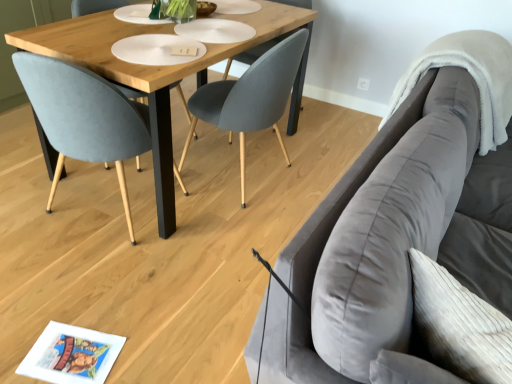
What is the approximate height of matte gray chair at center, which appears as the second chair when viewed from the left?

matte gray chair at center, which appears as the second chair when viewed from the left, is 84.76 centimeters in height.

Find the location of `white fluffy blanket at upper right`. white fluffy blanket at upper right is located at coordinates (471, 75).

What do you see at coordinates (151, 70) in the screenshot? This screenshot has width=512, height=384. I see `wooden table at center` at bounding box center [151, 70].

The image size is (512, 384). Identify the location of velvet blue chair at center, which appears as the 1th chair when viewed from the left. (84, 116).

Is white fluffy blanket at upper right bigger or smaller than velvet gray couch at right?

Considering their sizes, white fluffy blanket at upper right takes up less space than velvet gray couch at right.

Considering the sizes of white fluffy blanket at upper right and velvet gray couch at right in the image, is white fluffy blanket at upper right taller or shorter than velvet gray couch at right?

Considering their sizes, white fluffy blanket at upper right has less height than velvet gray couch at right.

Is white fluffy blanket at upper right far from velvet gray couch at right?

No, there isn't a large distance between white fluffy blanket at upper right and velvet gray couch at right.

How many degrees apart are the facing directions of wooden table at center and velvet gray couch at right?

wooden table at center and velvet gray couch at right are facing 1.5 degrees away from each other.

Are wooden table at center and velvet gray couch at right far apart?

Yes, wooden table at center and velvet gray couch at right are located far from each other.

Considering the relative positions of wooden table at center and velvet gray couch at right in the image provided, is wooden table at center behind velvet gray couch at right?

Yes, it is behind velvet gray couch at right.

Considering the positions of objects wooden table at center and velvet gray couch at right in the image provided, who is more to the left, wooden table at center or velvet gray couch at right?

wooden table at center is more to the left.

This screenshot has height=384, width=512. Identify the location of chair that is in front of the wooden table at center. (84, 116).

From the image's perspective, is wooden table at center located above or below velvet blue chair at center, which appears as the 1th chair when viewed from the left?

wooden table at center is situated higher than velvet blue chair at center, which appears as the 1th chair when viewed from the left, in the image.

Between wooden table at center and velvet blue chair at center, which is counted as the 2th chair, starting from the right, which one has less height?

Standing shorter between the two is wooden table at center.

Can you tell me how much wooden table at center and velvet blue chair at center, which appears as the 1th chair when viewed from the left, differ in facing direction?

The angle between the facing direction of wooden table at center and the facing direction of velvet blue chair at center, which appears as the 1th chair when viewed from the left, is 99.6 degrees.

Considering the relative sizes of white fluffy blanket at upper right and wooden table at center in the image provided, is white fluffy blanket at upper right shorter than wooden table at center?

Yes, white fluffy blanket at upper right is shorter than wooden table at center.

Is white fluffy blanket at upper right positioned far away from wooden table at center?

No, white fluffy blanket at upper right is not far from wooden table at center.

Which object is closer to the camera, white fluffy blanket at upper right or wooden table at center?

wooden table at center is more forward.

Based on their positions, is white fluffy blanket at upper right located to the left or right of wooden table at center?

white fluffy blanket at upper right is positioned on wooden table at center's right side.

Can you tell me how much wooden table at center and white fluffy blanket at upper right differ in facing direction?

1.5 degrees separate the facing orientations of wooden table at center and white fluffy blanket at upper right.

Choose the correct answer: Is wooden table at center inside white fluffy blanket at upper right or outside it?

wooden table at center is outside white fluffy blanket at upper right.

Considering the relative positions of wooden table at center and white fluffy blanket at upper right in the image provided, is wooden table at center to the left or to the right of white fluffy blanket at upper right?

wooden table at center is positioned on white fluffy blanket at upper right's left side.

Which of these two, matte gray chair at center, the 1th chair in the right-to-left sequence, or wooden table at center, is smaller?

With smaller size is matte gray chair at center, the 1th chair in the right-to-left sequence.

Is matte gray chair at center, the 1th chair in the right-to-left sequence, spatially inside wooden table at center, or outside of it?

matte gray chair at center, the 1th chair in the right-to-left sequence, lies within the bounds of wooden table at center.

From the image's perspective, is matte gray chair at center, the 1th chair in the right-to-left sequence, on top of wooden table at center?

Incorrect, from the image's perspective, matte gray chair at center, the 1th chair in the right-to-left sequence, is lower than wooden table at center.

Is matte gray chair at center, which appears as the second chair when viewed from the left, positioned in front of wooden table at center?

No, it is not.

Looking at this image, from the image's perspective, between velvet gray couch at right and white fluffy blanket at upper right, which one is located above?

From the image's view, white fluffy blanket at upper right is above.

From a real-world perspective, which is physically above, velvet gray couch at right or white fluffy blanket at upper right?

white fluffy blanket at upper right, from a real-world perspective.

Considering the positions of objects velvet gray couch at right and white fluffy blanket at upper right in the image provided, who is more to the right, velvet gray couch at right or white fluffy blanket at upper right?

From the viewer's perspective, white fluffy blanket at upper right appears more on the right side.

In the image, there is a velvet gray couch at right. Find the location of `blanket above it (from the image's perspective)`. blanket above it (from the image's perspective) is located at coordinates (471, 75).

Find the location of a particular element. studio couch to the right of wooden table at center is located at coordinates (400, 227).

Considering their positions, is velvet blue chair at center, which is counted as the 2th chair, starting from the right, positioned further to matte gray chair at center, the 1th chair in the right-to-left sequence, than white fluffy blanket at upper right?

white fluffy blanket at upper right is further to matte gray chair at center, the 1th chair in the right-to-left sequence.

Considering their positions, is white fluffy blanket at upper right positioned further to wooden table at center than velvet gray couch at right?

Based on the image, velvet gray couch at right appears to be further to wooden table at center.

Looking at the image, which one is located further to wooden table at center, velvet blue chair at center, which appears as the 1th chair when viewed from the left, or white fluffy blanket at upper right?

Among the two, white fluffy blanket at upper right is located further to wooden table at center.

Considering their positions, is wooden table at center positioned further to velvet gray couch at right than velvet blue chair at center, which is counted as the 2th chair, starting from the right?

velvet blue chair at center, which is counted as the 2th chair, starting from the right, is positioned further to the anchor velvet gray couch at right.

Looking at this image, looking at the image, which one is located further to white fluffy blanket at upper right, velvet gray couch at right or velvet blue chair at center, which is counted as the 2th chair, starting from the right?

The object further to white fluffy blanket at upper right is velvet blue chair at center, which is counted as the 2th chair, starting from the right.

Based on their spatial positions, is wooden table at center or velvet gray couch at right closer to matte gray chair at center, which appears as the second chair when viewed from the left?

The object closer to matte gray chair at center, which appears as the second chair when viewed from the left, is wooden table at center.

Based on their spatial positions, is white fluffy blanket at upper right or velvet blue chair at center, which appears as the 1th chair when viewed from the left, closer to velvet gray couch at right?

The object closer to velvet gray couch at right is white fluffy blanket at upper right.

Estimate the real-world distances between objects in this image. Which object is closer to wooden table at center, velvet blue chair at center, which is counted as the 2th chair, starting from the right, or velvet gray couch at right?

Based on the image, velvet blue chair at center, which is counted as the 2th chair, starting from the right, appears to be nearer to wooden table at center.

In order to click on coffee table situated between velvet blue chair at center, which appears as the 1th chair when viewed from the left, and velvet gray couch at right from left to right in this screenshot , I will do [151, 70].

Identify the location of blanket positioned between velvet gray couch at right and matte gray chair at center, which appears as the second chair when viewed from the left, from near to far. The height and width of the screenshot is (384, 512). (471, 75).

At what (x,y) coordinates should I click in order to perform the action: click on studio couch between wooden table at center and white fluffy blanket at upper right from left to right. Please return your answer as a coordinate pair (x, y). This screenshot has width=512, height=384. Looking at the image, I should click on (400, 227).

The height and width of the screenshot is (384, 512). I want to click on coffee table between velvet blue chair at center, which appears as the 1th chair when viewed from the left, and matte gray chair at center, the 1th chair in the right-to-left sequence, so click(151, 70).